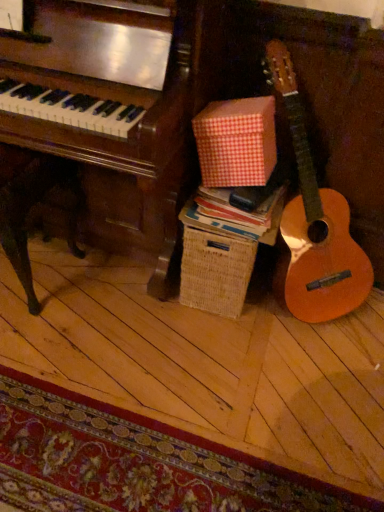
Question: From a real-world perspective, is red checkered cardboard box at center positioned above or below red checkered paper at center?

Choices:
 (A) above
 (B) below

Answer: (A)

Question: Is point (244, 181) closer or farther from the camera than point (206, 226)?

Choices:
 (A) closer
 (B) farther

Answer: (A)

Question: Estimate the real-world distances between objects in this image. Which object is closer to the carpeted mat at lower left?

Choices:
 (A) red checkered cardboard box at center
 (B) red checkered paper at center

Answer: (B)

Question: Based on their relative distances, which object is nearer to the carpeted mat at lower left?

Choices:
 (A) red checkered cardboard box at center
 (B) red checkered paper at center

Answer: (B)